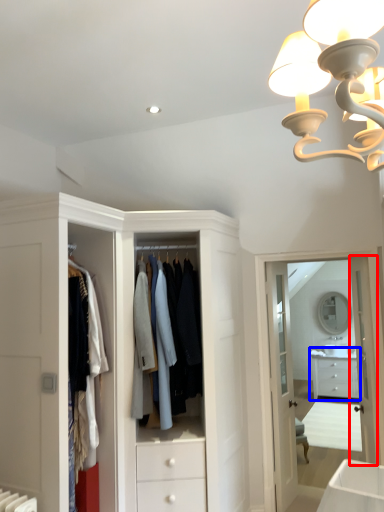
Question: Which of the following is the closest to the observer, door (highlighted by a red box) or chest of drawers (highlighted by a blue box)?

Choices:
 (A) door
 (B) chest of drawers

Answer: (A)